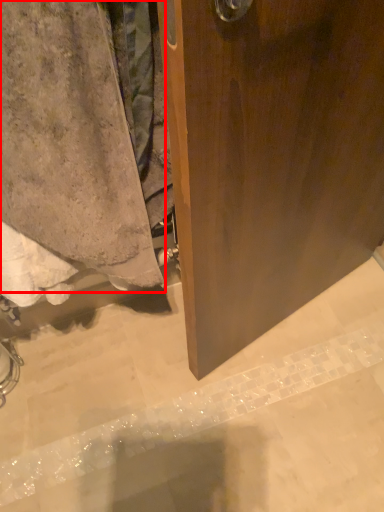
Question: From the image's perspective, what is the correct spatial relationship of towel (annotated by the red box) in relation to concrete?

Choices:
 (A) above
 (B) below

Answer: (A)